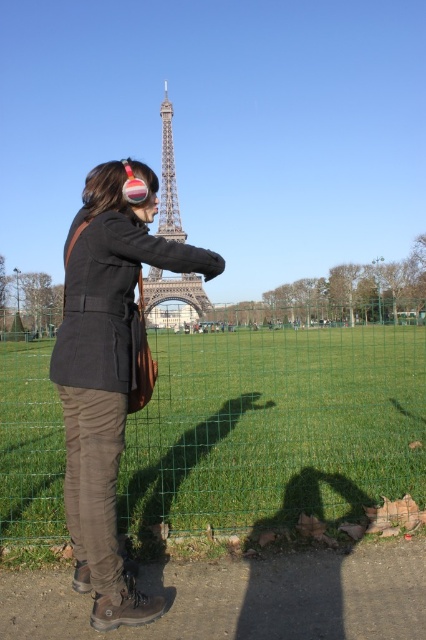
Question: Which point is farther from the camera taking this photo?

Choices:
 (A) (120, 403)
 (B) (146, 412)

Answer: (B)

Question: Does matte black jacket at center have a lesser width compared to metallic silver eiffel tower at center?

Choices:
 (A) no
 (B) yes

Answer: (A)

Question: Can you confirm if green wire mesh fence at center is wider than metallic silver eiffel tower at center?

Choices:
 (A) yes
 (B) no

Answer: (A)

Question: Among these objects, which one is farthest from the camera?

Choices:
 (A) matte black jacket at center
 (B) green wire mesh fence at center

Answer: (B)

Question: Which of the following is the farthest from the observer?

Choices:
 (A) green wire mesh fence at center
 (B) metallic silver eiffel tower at center
 (C) matte black jacket at center

Answer: (A)

Question: From the image, what is the correct spatial relationship of green wire mesh fence at center in relation to matte black jacket at center?

Choices:
 (A) right
 (B) left

Answer: (A)